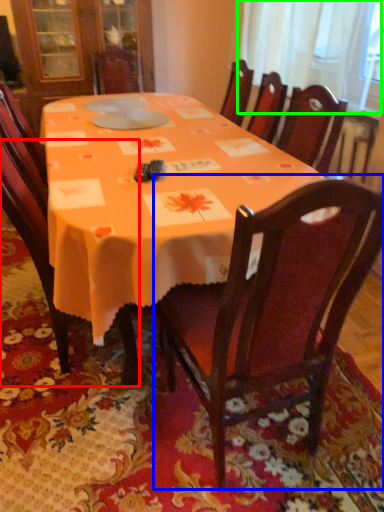
Question: Which object is positioned closest to chair (highlighted by a red box)? Select from chair (highlighted by a blue box) and curtain (highlighted by a green box).

Choices:
 (A) chair
 (B) curtain

Answer: (A)